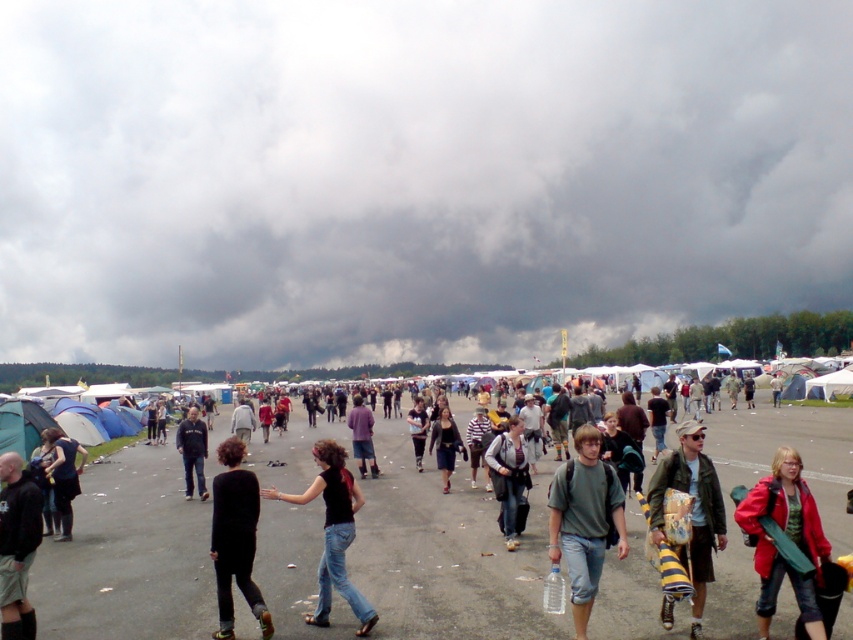
Can you confirm if black matte jeans at center is smaller than denim jacket at center?

Actually, black matte jeans at center might be larger than denim jacket at center.

Measure the distance between point (341, 584) and camera.

Point (341, 584) and camera are 22.86 feet apart from each other.

Does point (357, 595) come closer to viewer compared to point (514, 461)?

Yes, point (357, 595) is in front of point (514, 461).

Where is `black matte jeans at center`? This screenshot has width=853, height=640. black matte jeans at center is located at coordinates (334, 532).

What do you see at coordinates (16, 547) in the screenshot? This screenshot has width=853, height=640. I see `black matte jacket at lower left` at bounding box center [16, 547].

How far apart are black matte jacket at lower left and black fabric jacket at center?

black matte jacket at lower left and black fabric jacket at center are 12.70 meters apart from each other.

Between point (4, 484) and point (422, 440), which one is positioned in front?

Point (4, 484)

Where is `black matte jacket at lower left`? black matte jacket at lower left is located at coordinates (16, 547).

From the picture: Is red leather jacket at center positioned before green fabric jacket at center?

Yes, it is in front of green fabric jacket at center.

From the picture: Between red leather jacket at center and green fabric jacket at center, which one is positioned higher?

green fabric jacket at center is above.

At what (x,y) coordinates should I click in order to perform the action: click on red leather jacket at center. Please return your answer as a coordinate pair (x, y). Image resolution: width=853 pixels, height=640 pixels. Looking at the image, I should click on (784, 540).

You are a GUI agent. You are given a task and a screenshot of the screen. Output one action in this format:
    pyautogui.click(x=<x>, y=<y>)
    Task: Click on the red leather jacket at center
    Image resolution: width=853 pixels, height=640 pixels.
    Given the screenshot: What is the action you would take?
    pyautogui.click(x=784, y=540)